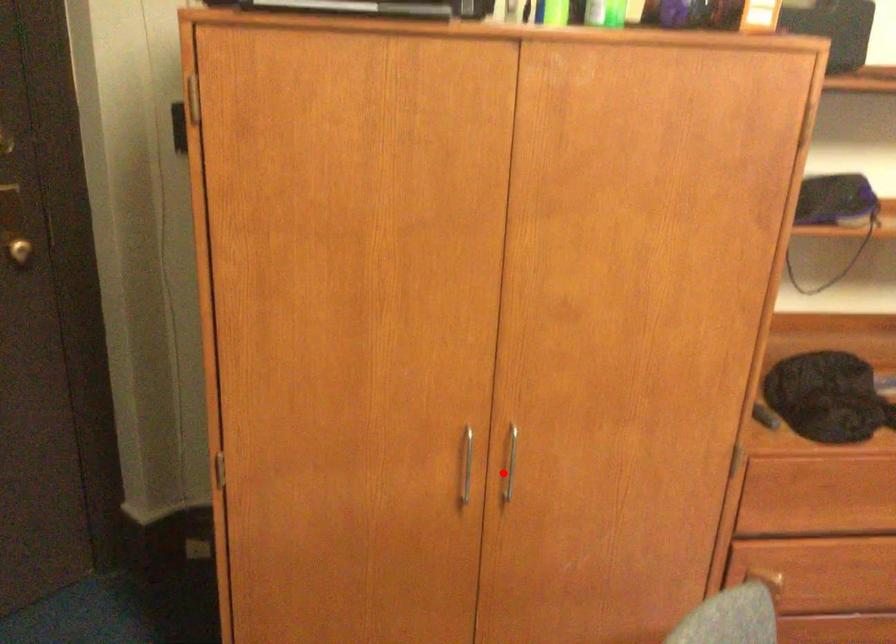
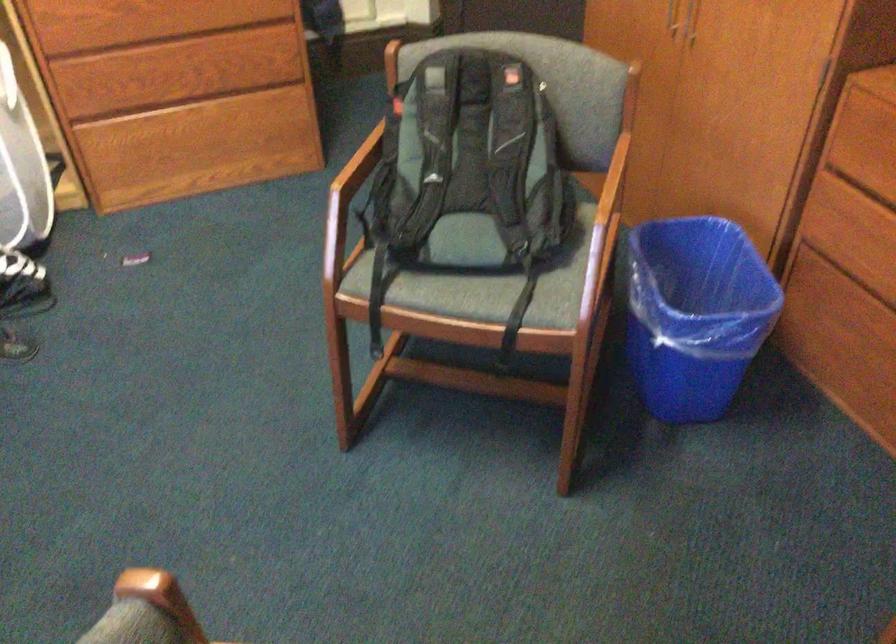
Locate, in the second image, the point that corresponds to the highlighted location in the first image.

(691, 21)